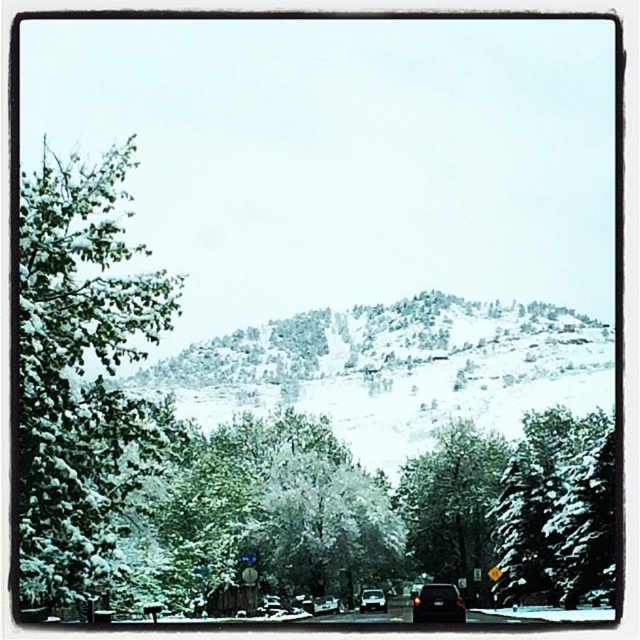
You are standing at the starting point of the road in the winter scene. There are two points marked on the road ahead of you. One is at coordinates point (461,605) and the other is at point (381,605). Which point is closer to you?

Point (461,605) is in front of point (381,605), so the point closer to you is point (461,605).